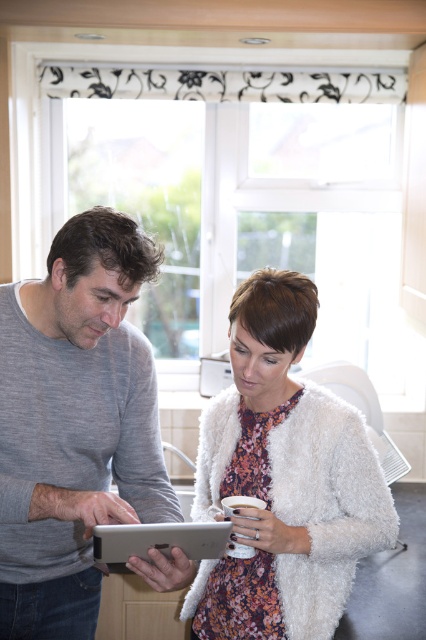
Which is more to the right, gray matte shirt at left or silver metallic tablet at center?

silver metallic tablet at center

Does gray matte shirt at left have a lesser height compared to silver metallic tablet at center?

Incorrect, gray matte shirt at left's height does not fall short of silver metallic tablet at center's.

Which is behind, point (135, 371) or point (120, 554)?

Point (135, 371)

Where is `gray matte shirt at left`? gray matte shirt at left is located at coordinates (74, 422).

Who is taller, white fluffy jacket at center or silver metallic tablet at center?

With more height is white fluffy jacket at center.

Can you confirm if white fluffy jacket at center is taller than silver metallic tablet at center?

Yes.

Identify the location of white fluffy jacket at center. (74, 422).

Identify the location of white fluffy jacket at center. (74, 422).

Based on the photo, which is more to the right, gray matte shirt at left or white fluffy cardigan at center?

white fluffy cardigan at center

Which is in front, point (3, 420) or point (317, 456)?

Point (3, 420)

Locate an element on the screen. gray matte shirt at left is located at coordinates (74, 422).